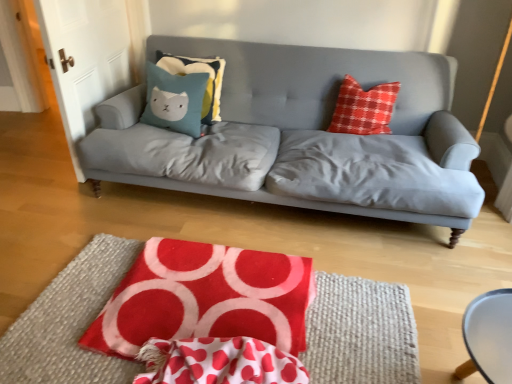
Identify the location of vacant position to the left of red velvety quilt at lower center. (76, 304).